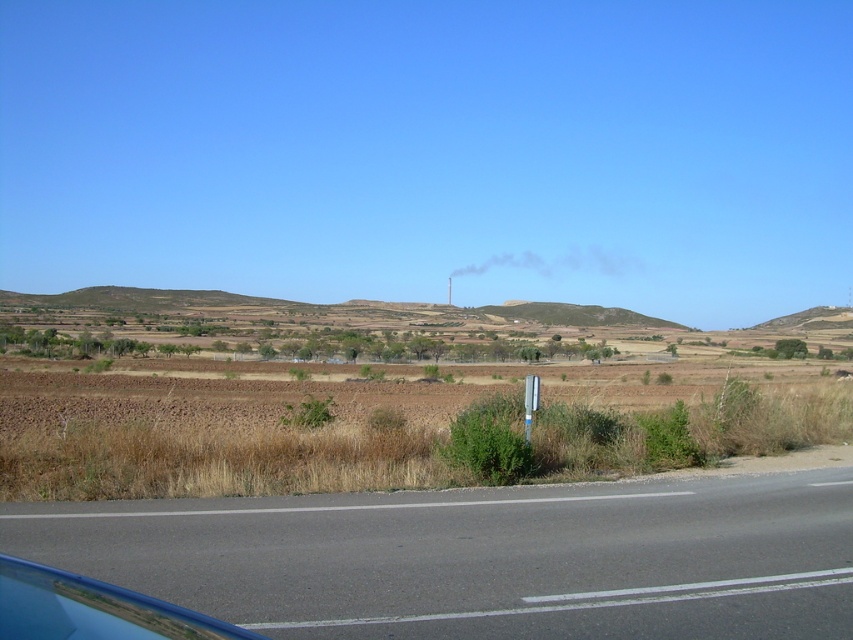
Does asphalt road at lower center appear on the right side of dry grass at lower left?

No, asphalt road at lower center is not to the right of dry grass at lower left.

Which of these two, asphalt road at lower center or dry grass at lower left, stands taller?

dry grass at lower left

Find the location of a particular element. asphalt road at lower center is located at coordinates (480, 557).

Does dry grass at lower left lie behind white plastic sign at center?

No.

The image size is (853, 640). Describe the element at coordinates (218, 442) in the screenshot. I see `dry grass at lower left` at that location.

This screenshot has height=640, width=853. Find the location of `dry grass at lower left`. dry grass at lower left is located at coordinates (218, 442).

Between blue glass car window at lower left and white plastic sign at center, which one is positioned higher?

Positioned higher is white plastic sign at center.

Is point (90, 636) farther from camera compared to point (531, 404)?

No, (90, 636) is in front of (531, 404).

Is point (22, 630) farther from viewer compared to point (527, 378)?

That is False.

You are a GUI agent. You are given a task and a screenshot of the screen. Output one action in this format:
    pyautogui.click(x=<x>, y=<y>)
    Task: Click on the blue glass car window at lower left
    The height and width of the screenshot is (640, 853).
    Given the screenshot: What is the action you would take?
    [x=91, y=609]